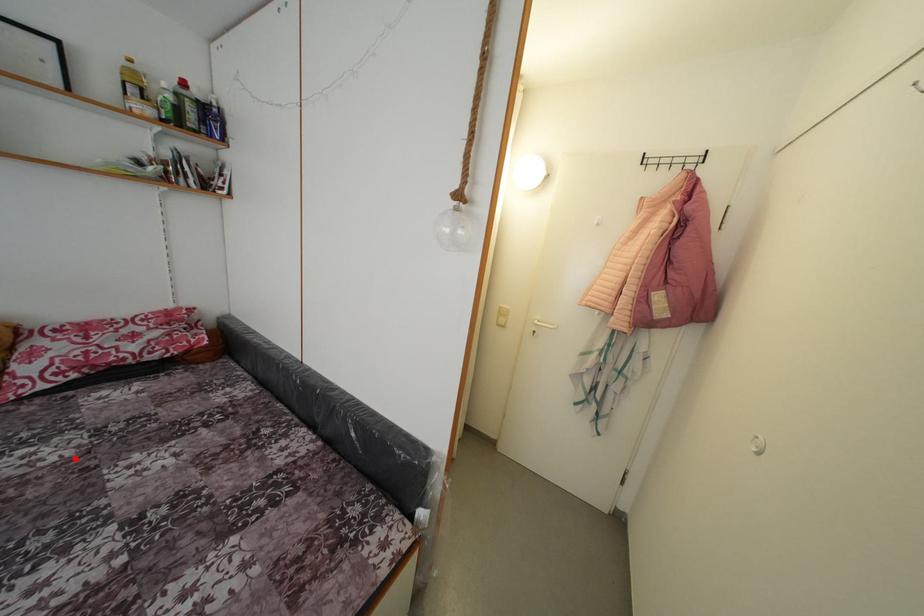
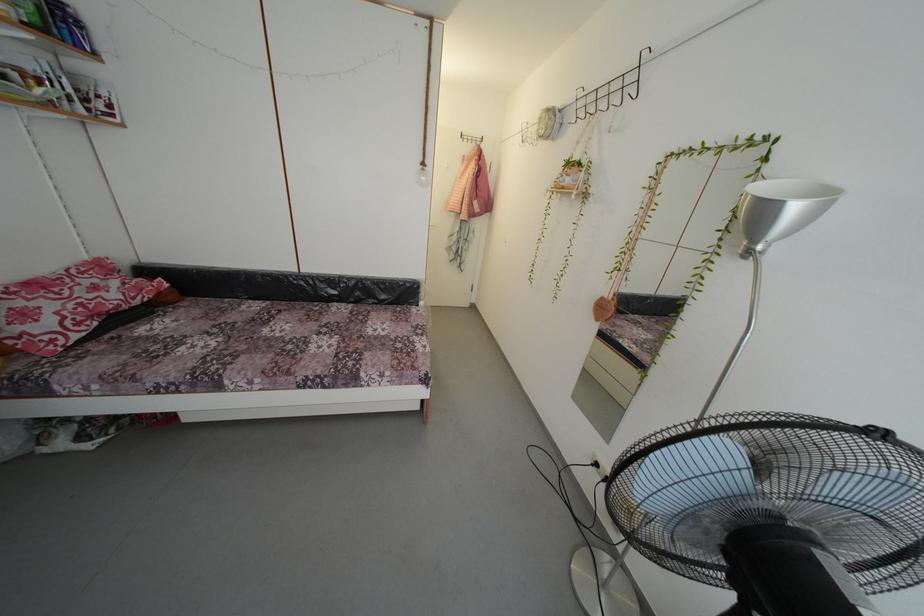
Where in the second image is the point corresponding to the highlighted location from the first image?

(225, 345)